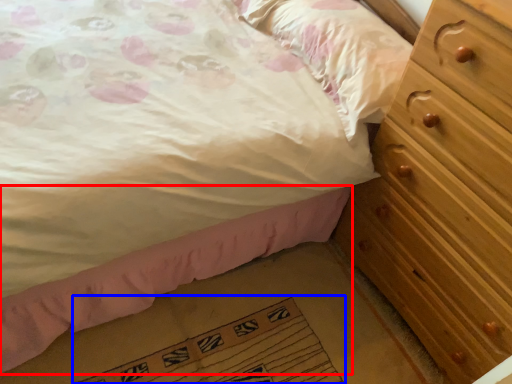
Question: Which point is closer to the camera, bed frame (highlighted by a red box) or doormat (highlighted by a blue box)?

Choices:
 (A) bed frame
 (B) doormat

Answer: (A)